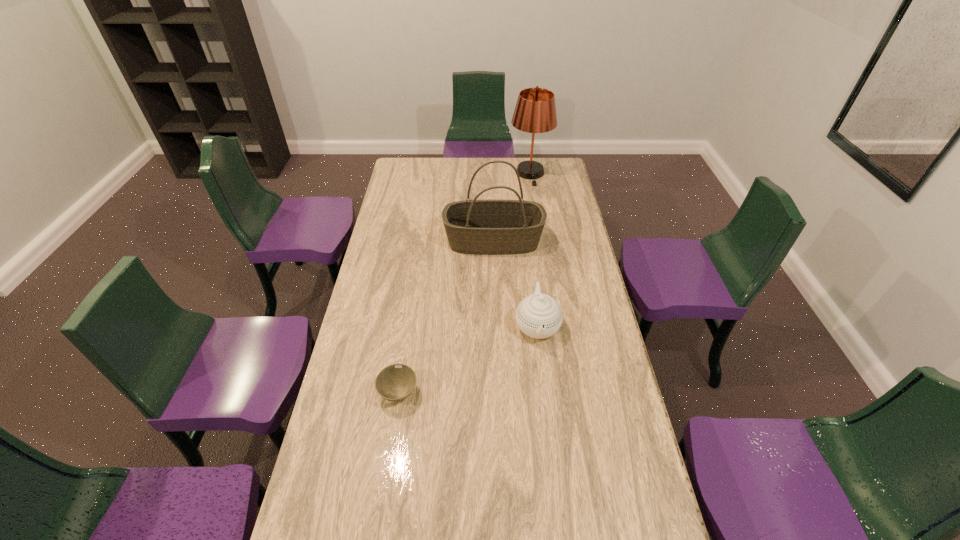
In order to click on vacant space located 0.290m on the spout of the second nearest object in this screenshot , I will do [x=550, y=434].

The image size is (960, 540). Identify the location of vacant region located 0.110m on the left of the bowl. (344, 393).

You are a GUI agent. You are given a task and a screenshot of the screen. Output one action in this format:
    pyautogui.click(x=<x>, y=<y>)
    Task: Click on the object that is at the far edge
    This screenshot has height=540, width=960.
    Given the screenshot: What is the action you would take?
    pyautogui.click(x=535, y=112)

Identify the location of object present at the left edge. The height and width of the screenshot is (540, 960). (395, 382).

At what (x,y) coordinates should I click in order to perform the action: click on lampshade present at the right edge. Please return your answer as a coordinate pair (x, y). Looking at the image, I should click on (535, 112).

You are a GUI agent. You are given a task and a screenshot of the screen. Output one action in this format:
    pyautogui.click(x=<x>, y=<y>)
    Task: Click on the chinaware located at the right edge
    
    Given the screenshot: What is the action you would take?
    pyautogui.click(x=539, y=316)

Locate an element on the screen. object at the far right corner is located at coordinates (535, 112).

In the image, there is a desktop. In order to click on free space at the far edge in this screenshot , I will do `click(495, 168)`.

Where is `vacant region at the left edge of the desktop`? The height and width of the screenshot is (540, 960). vacant region at the left edge of the desktop is located at coordinates (403, 241).

This screenshot has height=540, width=960. I want to click on free space at the right edge of the desktop, so click(635, 504).